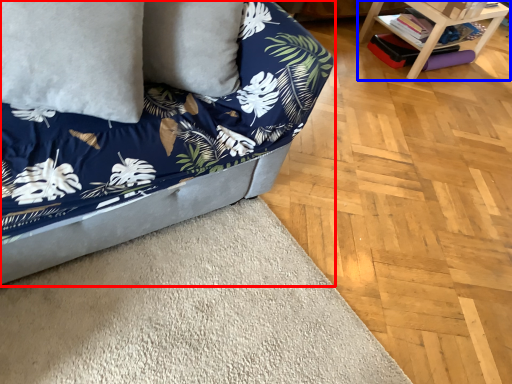
Question: Which of the following is the farthest to the observer, studio couch (highlighted by a red box) or table (highlighted by a blue box)?

Choices:
 (A) studio couch
 (B) table

Answer: (B)